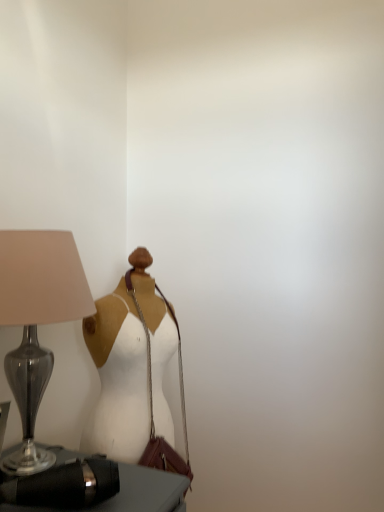
Question: From their relative heights in the image, would you say leather shoulder bag at center is taller or shorter than white matte dress at center?

Choices:
 (A) tall
 (B) short

Answer: (B)

Question: Looking at their shapes, would you say leather shoulder bag at center is wider or thinner than white matte dress at center?

Choices:
 (A) wide
 (B) thin

Answer: (B)

Question: Which object is positioned farthest from the leather shoulder bag at center?

Choices:
 (A) white matte dress at center
 (B) black leather bag at lower left
 (C) matte glass lamp at left

Answer: (C)

Question: Considering the real-world distances, which object is farthest from the matte glass lamp at left?

Choices:
 (A) white matte dress at center
 (B) black leather bag at lower left
 (C) leather shoulder bag at center

Answer: (C)